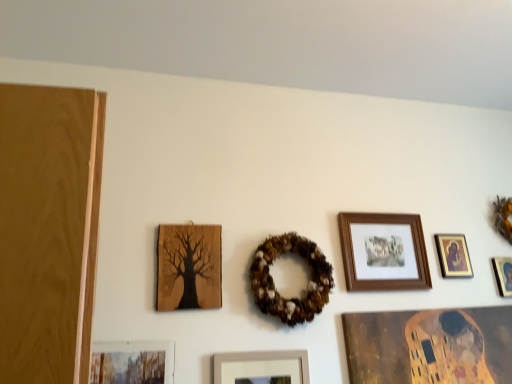
Question: Is matte black picture frame at upper right, the 1th picture frame positioned from the right, shorter than brown textured wreath at center, the 1th decor viewed from the left?

Choices:
 (A) no
 (B) yes

Answer: (B)

Question: Is matte black picture frame at upper right, the 6th picture frame from the left, facing towards brown textured wreath at center, which is counted as the second decor, starting from the right?

Choices:
 (A) no
 (B) yes

Answer: (A)

Question: Is matte black picture frame at upper right, the 1th picture frame positioned from the right, placed right next to brown textured wreath at center, the 1th decor viewed from the left?

Choices:
 (A) no
 (B) yes

Answer: (A)

Question: Would you say matte black picture frame at upper right, the 6th picture frame from the left, is outside brown textured wreath at center, which is the second decor in back-to-front order?

Choices:
 (A) yes
 (B) no

Answer: (A)

Question: From the image's perspective, is matte black picture frame at upper right, the 1th picture frame positioned from the right, beneath brown textured wreath at center, the 1th decor viewed from the left?

Choices:
 (A) no
 (B) yes

Answer: (B)

Question: Considering the relative positions of matte black picture frame at upper right, the 6th picture frame from the left, and matte white picture frame at center, which appears as the 4th picture frame when viewed from the right, in the image provided, is matte black picture frame at upper right, the 6th picture frame from the left, to the left or to the right of matte white picture frame at center, which appears as the 4th picture frame when viewed from the right,?

Choices:
 (A) right
 (B) left

Answer: (A)

Question: Is matte black picture frame at upper right, the 1th picture frame positioned from the right, taller or shorter than matte white picture frame at center, which is the 3th picture frame from left to right?

Choices:
 (A) short
 (B) tall

Answer: (A)

Question: From the image's perspective, is matte black picture frame at upper right, the 6th picture frame from the left, positioned above or below matte white picture frame at center, which appears as the 4th picture frame when viewed from the right?

Choices:
 (A) above
 (B) below

Answer: (A)

Question: From a real-world perspective, is matte black picture frame at upper right, the 6th picture frame from the left, physically located above or below matte white picture frame at center, which is the 3th picture frame from left to right?

Choices:
 (A) below
 (B) above

Answer: (B)

Question: From a real-world perspective, is wooden tree silhouette at left, arranged as the fifth picture frame when viewed from the right, above or below matte white picture frame at center, which is the 3th picture frame from left to right?

Choices:
 (A) above
 (B) below

Answer: (A)

Question: From the image's perspective, is wooden tree silhouette at left, which is the 2th picture frame from left to right, positioned above or below matte white picture frame at center, which is the 3th picture frame from left to right?

Choices:
 (A) below
 (B) above

Answer: (B)

Question: In the image, is wooden tree silhouette at left, arranged as the fifth picture frame when viewed from the right, positioned in front of or behind matte white picture frame at center, which is the 3th picture frame from left to right?

Choices:
 (A) behind
 (B) front

Answer: (A)

Question: Do you think wooden tree silhouette at left, arranged as the fifth picture frame when viewed from the right, is within matte white picture frame at center, which appears as the 4th picture frame when viewed from the right, or outside of it?

Choices:
 (A) inside
 (B) outside

Answer: (B)

Question: Choose the correct answer: Is gold-framed picture at upper right, the fifth picture frame from the left, inside orange fabric wreath at upper right, which is the 1th decor in right-to-left order, or outside it?

Choices:
 (A) inside
 (B) outside

Answer: (B)

Question: Does point (438, 236) appear closer or farther from the camera than point (507, 213)?

Choices:
 (A) closer
 (B) farther

Answer: (A)